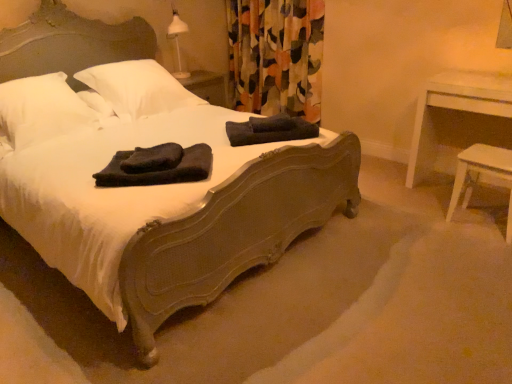
This screenshot has height=384, width=512. What do you see at coordinates (159, 171) in the screenshot? I see `black towel at center, arranged as the 2th material when viewed from the right` at bounding box center [159, 171].

Measure the distance between white soft pillow at upper left, the first pillow positioned from the left, and camera.

white soft pillow at upper left, the first pillow positioned from the left, is 2.41 meters from camera.

The height and width of the screenshot is (384, 512). What do you see at coordinates (233, 232) in the screenshot? I see `matte dark wood bed at center` at bounding box center [233, 232].

Describe the element at coordinates (276, 56) in the screenshot. I see `multicolored fabric curtain at upper center` at that location.

Describe the element at coordinates (479, 174) in the screenshot. The width and height of the screenshot is (512, 384). I see `white wood stool at lower right` at that location.

The image size is (512, 384). I want to click on dark cotton towels at center, the first material in the top-to-bottom sequence, so click(x=270, y=130).

Is white wood table at right at the back of white wood stool at lower right?

Absolutely, white wood stool at lower right is directed away from white wood table at right.

From a real-world perspective, is white wood stool at lower right positioned under white wood table at right based on gravity?

Indeed, from a real-world perspective, white wood stool at lower right is positioned beneath white wood table at right.

From the image's perspective, would you say white wood stool at lower right is positioned over white wood table at right?

Actually, white wood stool at lower right appears below white wood table at right in the image.

Based on the photo, can you confirm if white wood stool at lower right is thinner than white wood table at right?

Indeed, white wood stool at lower right has a lesser width compared to white wood table at right.

Is white wood stool at lower right turned away from white soft pillow at upper left, acting as the second pillow starting from the right?

That's not correct — white wood stool at lower right is not looking away from white soft pillow at upper left, acting as the second pillow starting from the right.

Is white wood stool at lower right touching white soft pillow at upper left, the first pillow positioned from the left?

No, white wood stool at lower right is not making contact with white soft pillow at upper left, the first pillow positioned from the left.

From a real-world perspective, is white wood stool at lower right on top of white soft pillow at upper left, acting as the second pillow starting from the right?

No, from a real-world perspective, white wood stool at lower right is not above white soft pillow at upper left, acting as the second pillow starting from the right.

Which object is closer to the camera taking this photo, white wood stool at lower right or white soft pillow at upper left, acting as the second pillow starting from the right?

white soft pillow at upper left, acting as the second pillow starting from the right, is in front.

From a real-world perspective, is white soft pillow at upper left, the second pillow in the left-to-right sequence, on white wood table at right?

Yes, from a real-world perspective, white soft pillow at upper left, the second pillow in the left-to-right sequence, is above white wood table at right.

Does white soft pillow at upper left, the second pillow in the left-to-right sequence, have a lesser width compared to white wood table at right?

No, white soft pillow at upper left, the second pillow in the left-to-right sequence, is not thinner than white wood table at right.

Can you tell me how much white soft pillow at upper left, the second pillow in the left-to-right sequence, and white wood table at right differ in facing direction?

The facing directions of white soft pillow at upper left, the second pillow in the left-to-right sequence, and white wood table at right are 90.3 degrees apart.

From the image's perspective, is white soft pillow at upper left, which is the 1th pillow in right-to-left order, under white wood table at right?

No, from the image's perspective, white soft pillow at upper left, which is the 1th pillow in right-to-left order, is not beneath white wood table at right.

Locate an element on the screen. Image resolution: width=512 pixels, height=384 pixels. nightstand on the right of the black towel at center, which is the first material in left-to-right order is located at coordinates (454, 110).

Considering the sizes of black towel at center, marked as the first material in a front-to-back arrangement, and white wood table at right in the image, is black towel at center, marked as the first material in a front-to-back arrangement, bigger or smaller than white wood table at right?

In the image, black towel at center, marked as the first material in a front-to-back arrangement, appears to be smaller than white wood table at right.

Which is closer to the camera, (x=197, y=169) or (x=430, y=154)?

Point (x=197, y=169)

Between black towel at center, the first material positioned from the bottom, and white wood table at right, which one appears on the right side from the viewer's perspective?

From the viewer's perspective, white wood table at right appears more on the right side.

Is white wood stool at lower right in front of or behind multicolored fabric curtain at upper center in the image?

Visually, white wood stool at lower right is located in front of multicolored fabric curtain at upper center.

Is white wood stool at lower right looking in the opposite direction of multicolored fabric curtain at upper center?

No, white wood stool at lower right is not facing the opposite direction of multicolored fabric curtain at upper center.

Based on the photo, in terms of width, does white wood stool at lower right look wider or thinner when compared to multicolored fabric curtain at upper center?

In the image, white wood stool at lower right appears to be more narrow than multicolored fabric curtain at upper center.

Based on the photo, in terms of size, does white wood stool at lower right appear bigger or smaller than multicolored fabric curtain at upper center?

white wood stool at lower right is smaller than multicolored fabric curtain at upper center.

Can you confirm if white soft pillow at upper left, acting as the second pillow starting from the right, is shorter than white wood stool at lower right?

Yes.

From the image's perspective, between white soft pillow at upper left, acting as the second pillow starting from the right, and white wood stool at lower right, who is located below?

white wood stool at lower right appears lower in the image.

Is white soft pillow at upper left, the first pillow positioned from the left, to the right of white wood stool at lower right from the viewer's perspective?

In fact, white soft pillow at upper left, the first pillow positioned from the left, is to the left of white wood stool at lower right.

Considering the points (40, 140) and (482, 169), which point is in front, point (40, 140) or point (482, 169)?

Point (482, 169)

Consider the image. Is white wood stool at lower right smaller than black towel at center, marked as the first material in a front-to-back arrangement?

No.

Could you tell me if white wood stool at lower right is facing black towel at center, the second material when ordered from top to bottom?

No, white wood stool at lower right is not oriented towards black towel at center, the second material when ordered from top to bottom.

From a real-world perspective, is white wood stool at lower right physically above black towel at center, positioned as the second material in back-to-front order?

No.

Is white wood stool at lower right not close to black towel at center, the second material when ordered from top to bottom?

Yes, white wood stool at lower right and black towel at center, the second material when ordered from top to bottom, are quite far apart.

At what (x,y) coordinates should I click in order to perform the action: click on nightstand above the white wood stool at lower right (from the image's perspective). Please return your answer as a coordinate pair (x, y). Looking at the image, I should click on (454, 110).

The image size is (512, 384). In order to click on pillow in front of the white wood stool at lower right in this screenshot , I will do `click(41, 109)`.

Based on their spatial positions, is dark cotton towels at center, arranged as the second material when viewed from the left, or matte dark wood bed at center closer to white soft pillow at upper left, the second pillow in the left-to-right sequence?

Among the two, dark cotton towels at center, arranged as the second material when viewed from the left, is located nearer to white soft pillow at upper left, the second pillow in the left-to-right sequence.

Consider the image. Which object lies nearer to the anchor point white soft pillow at upper left, the first pillow positioned from the left, white wood stool at lower right or white wood table at right?

The object closer to white soft pillow at upper left, the first pillow positioned from the left, is white wood table at right.

From the image, which object appears to be farther from white soft pillow at upper left, the first pillow positioned from the left, dark cotton towels at center, which ranks as the second material in front-to-back order, or white wood table at right?

white wood table at right.

From the image, which object appears to be farther from white soft pillow at upper left, the second pillow in the left-to-right sequence, black towel at center, marked as the first material in a front-to-back arrangement, or white wood table at right?

The object further to white soft pillow at upper left, the second pillow in the left-to-right sequence, is white wood table at right.

Based on their spatial positions, is white wood stool at lower right or white soft pillow at upper left, which is the 1th pillow in right-to-left order, further from multicolored fabric curtain at upper center?

The object further to multicolored fabric curtain at upper center is white wood stool at lower right.

Considering their positions, is dark cotton towels at center, arranged as the second material when viewed from the left, positioned further to white wood stool at lower right than white soft pillow at upper left, acting as the second pillow starting from the right?

The object further to white wood stool at lower right is white soft pillow at upper left, acting as the second pillow starting from the right.

Estimate the real-world distances between objects in this image. Which object is further from white soft pillow at upper left, which is the 1th pillow in right-to-left order, white wood table at right or dark cotton towels at center, arranged as the second material when viewed from the left?

Based on the image, white wood table at right appears to be further to white soft pillow at upper left, which is the 1th pillow in right-to-left order.

Estimate the real-world distances between objects in this image. Which object is closer to white wood table at right, black towel at center, marked as the first material in a front-to-back arrangement, or matte dark wood bed at center?

matte dark wood bed at center is closer to white wood table at right.

Where is `bed located between white soft pillow at upper left, acting as the second pillow starting from the right, and dark cotton towels at center, the first material in the top-to-bottom sequence, in the left-right direction`? This screenshot has height=384, width=512. bed located between white soft pillow at upper left, acting as the second pillow starting from the right, and dark cotton towels at center, the first material in the top-to-bottom sequence, in the left-right direction is located at coordinates (233, 232).

I want to click on pillow between white soft pillow at upper left, acting as the second pillow starting from the right, and dark cotton towels at center, the first material in the top-to-bottom sequence, so click(x=137, y=88).

Find the location of `pillow between white soft pillow at upper left, acting as the second pillow starting from the right, and white wood stool at lower right from left to right`. pillow between white soft pillow at upper left, acting as the second pillow starting from the right, and white wood stool at lower right from left to right is located at coordinates (137, 88).

Find the location of a particular element. nightstand positioned between matte dark wood bed at center and multicolored fabric curtain at upper center from near to far is located at coordinates (454, 110).